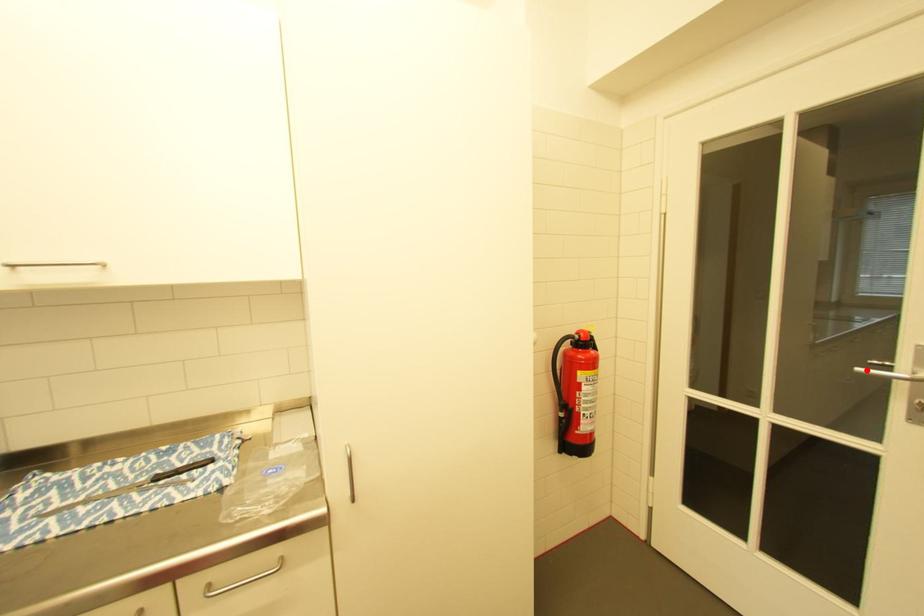
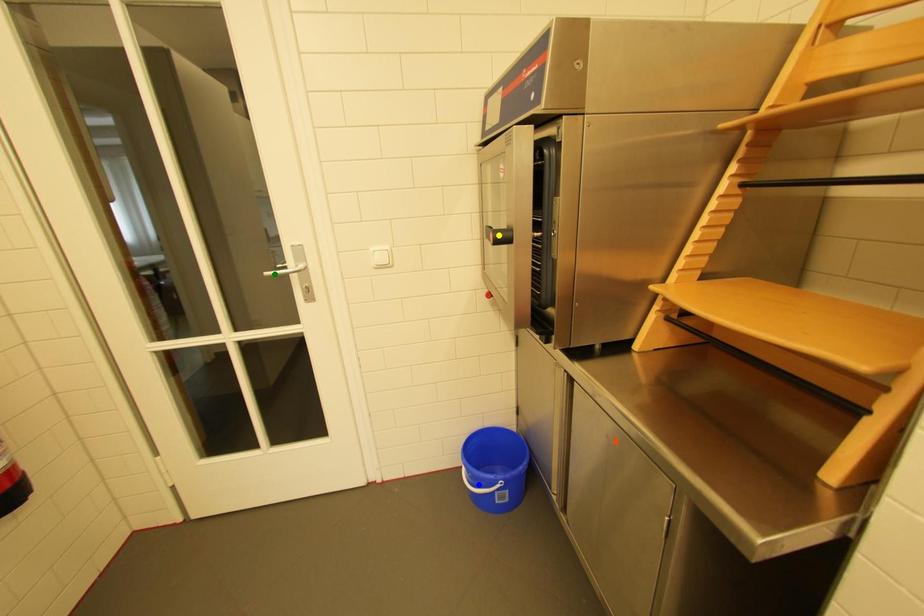
Question: I am providing you with two images of the same scene from different viewpoints. A red point is marked on the first image. You are given multiple points on the second image. Which point in image 2 is actually the same real-world point as the red point in image 1?

Choices:
 (A) yellow point
 (B) blue point
 (C) green point

Answer: (C)